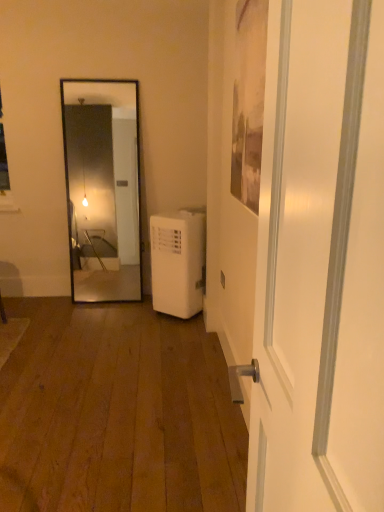
This screenshot has height=512, width=384. What are the coordinates of `free space to the left of white plastic air conditioner at lower right` in the screenshot? It's located at (116, 308).